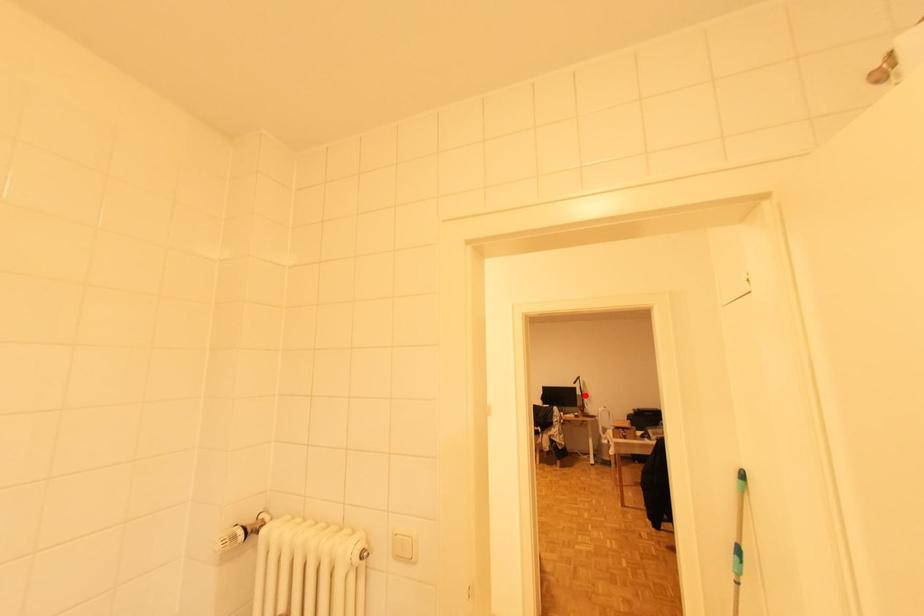
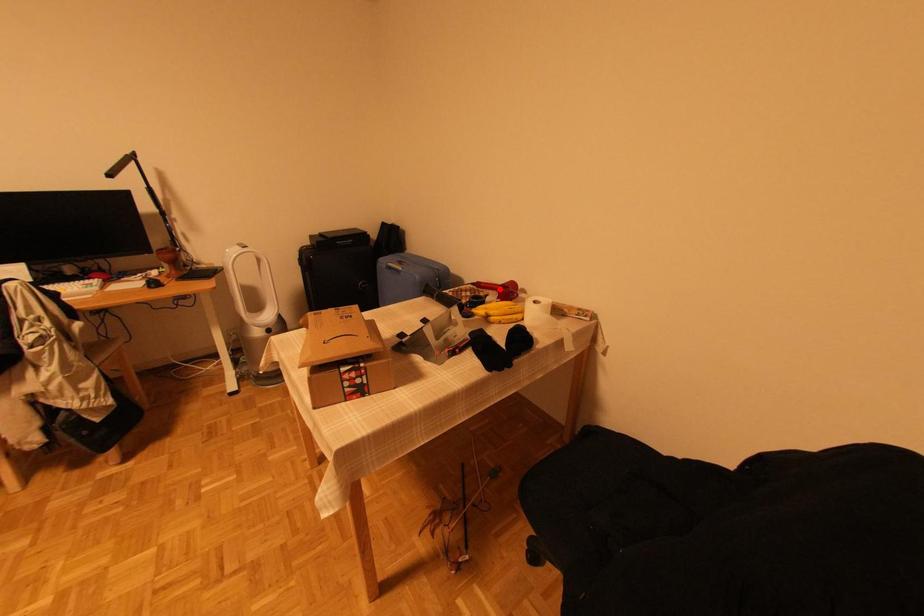
I am providing you with two images of the same scene from different viewpoints. A red point is marked on the first image and another point is marked on the second image. Does the point marked in image1 correspond to the same location as the one in image2?

No